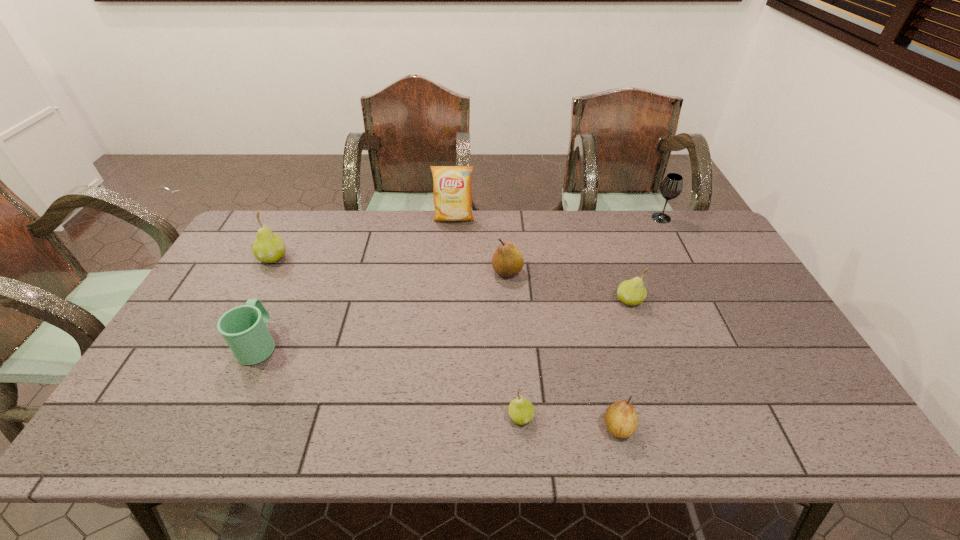
Identify which object is the third nearest to the fifth farthest object. Please provide its 2D coordinates. Your answer should be formatted as a tuple, i.e. [(x, y)], where the tuple contains the x and y coordinates of a point satisfying the conditions above.

[(671, 187)]

Point out which object is positioned as the second nearest to the wineglass. Please provide its 2D coordinates. Your answer should be formatted as a tuple, i.e. [(x, y)], where the tuple contains the x and y coordinates of a point satisfying the conditions above.

[(507, 261)]

Identify which pear is located as the third nearest to the leftmost pear. Please provide its 2D coordinates. Your answer should be formatted as a tuple, i.e. [(x, y)], where the tuple contains the x and y coordinates of a point satisfying the conditions above.

[(632, 292)]

Locate an element on the screen. The image size is (960, 540). pear that is the closest to the rightmost green pear is located at coordinates (507, 261).

Identify which green pear is the second closest to the tallest pear. Please provide its 2D coordinates. Your answer should be formatted as a tuple, i.e. [(x, y)], where the tuple contains the x and y coordinates of a point satisfying the conditions above.

[(632, 292)]

Select which green pear appears as the third closest to the gray wineglass. Please provide its 2D coordinates. Your answer should be formatted as a tuple, i.e. [(x, y)], where the tuple contains the x and y coordinates of a point satisfying the conditions above.

[(268, 247)]

Locate an element on the screen. The height and width of the screenshot is (540, 960). free space that satisfies the following two spatial constraints: 1. on the back side of the rightmost pear; 2. on the right side of the smallest green pear is located at coordinates tap(513, 300).

Where is `vacant space that satisfies the following two spatial constraints: 1. on the front-facing side of the farther brown pear; 2. on the left side of the tallest object`? This screenshot has width=960, height=540. vacant space that satisfies the following two spatial constraints: 1. on the front-facing side of the farther brown pear; 2. on the left side of the tallest object is located at coordinates (450, 272).